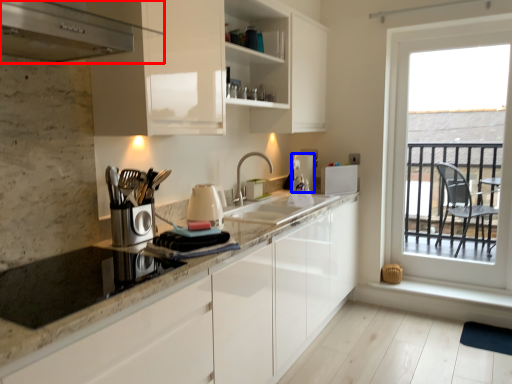
Question: Which point is closer to the camera, kitchen appliance (highlighted by a red box) or appliance (highlighted by a blue box)?

Choices:
 (A) kitchen appliance
 (B) appliance

Answer: (A)